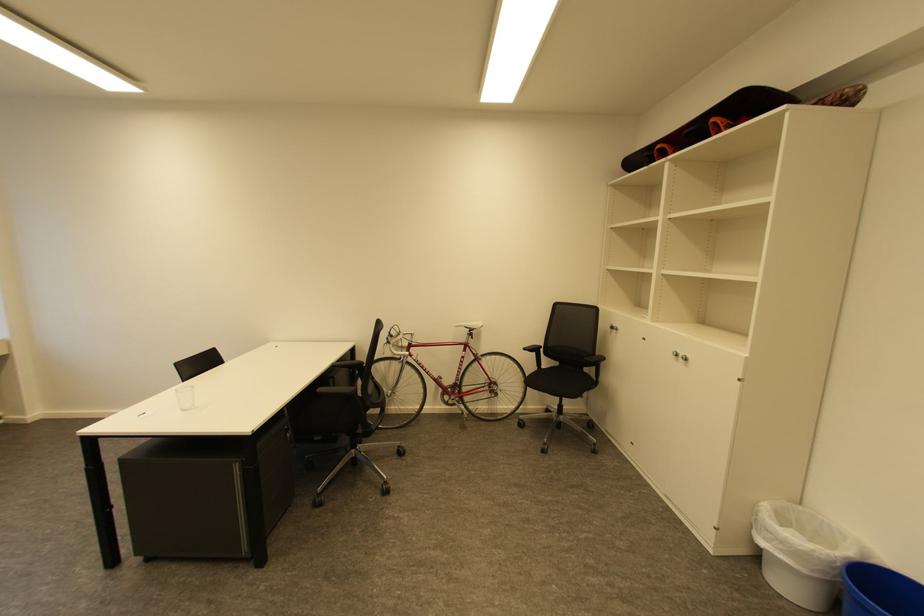
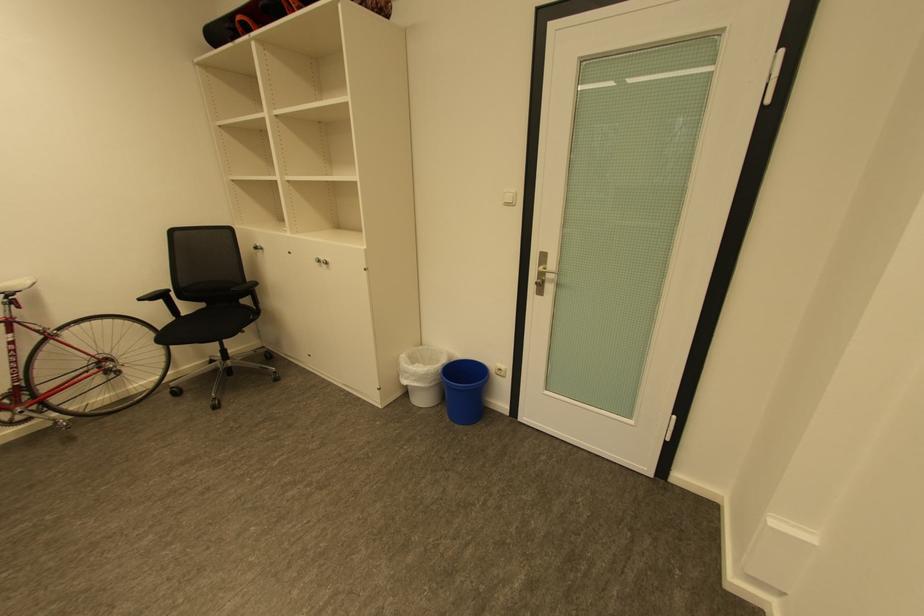
Find the pixel in the second image that matches point (684, 355) in the first image.

(325, 262)